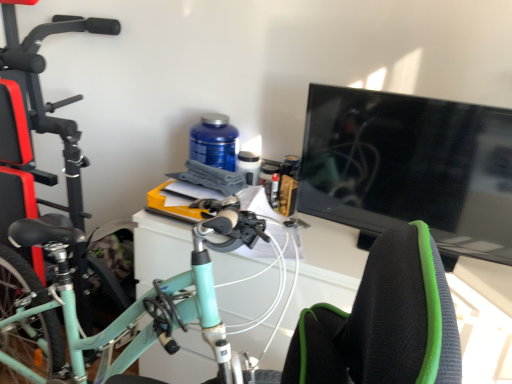
Image resolution: width=512 pixels, height=384 pixels. Describe the element at coordinates (214, 142) in the screenshot. I see `blue plastic bottle at center` at that location.

Where is `mint green matte bicycle at left`? mint green matte bicycle at left is located at coordinates pyautogui.click(x=31, y=143).

Where is `black glossy tv at right`? black glossy tv at right is located at coordinates (410, 167).

The width and height of the screenshot is (512, 384). In order to click on blue plastic bottle at center in this screenshot , I will do `click(214, 142)`.

Does point (326, 168) lie behind point (175, 230)?

No, (326, 168) is in front of (175, 230).

Is black glossy tv at right oriented towards white glossy computer desk at center?

Yes, black glossy tv at right faces towards white glossy computer desk at center.

From the image's perspective, which is above, black glossy tv at right or white glossy computer desk at center?

black glossy tv at right.

Are black glossy tv at right and white glossy computer desk at center far apart?

That's not correct — black glossy tv at right is a little close to white glossy computer desk at center.

Is point (226, 139) more distant than point (349, 275)?

Yes, it is.

Does blue plastic bottle at center turn towards white glossy computer desk at center?

No.

Can you confirm if blue plastic bottle at center is bigger than white glossy computer desk at center?

Incorrect, blue plastic bottle at center is not larger than white glossy computer desk at center.

In the image, is blue plastic bottle at center positioned in front of or behind white glossy computer desk at center?

Visually, blue plastic bottle at center is located behind white glossy computer desk at center.

Is mint green matte bicycle at left at the back of white glossy computer desk at center?

That's not correct — white glossy computer desk at center is not looking away from mint green matte bicycle at left.

Is white glossy computer desk at center directly adjacent to mint green matte bicycle at left?

No, white glossy computer desk at center is not in contact with mint green matte bicycle at left.

Considering the positions of points (317, 231) and (77, 137), is point (317, 231) closer to camera compared to point (77, 137)?

That is True.

Locate an element on the screen. This screenshot has height=384, width=512. bicycle below the white glossy computer desk at center (from a real-world perspective) is located at coordinates (31, 143).

Between white glossy computer desk at center and black glossy tv at right, which one appears on the left side from the viewer's perspective?

white glossy computer desk at center is more to the left.

From the image's perspective, is white glossy computer desk at center below black glossy tv at right?

Yes.

Would you say white glossy computer desk at center is a long distance from black glossy tv at right?

That's not correct — white glossy computer desk at center is a little close to black glossy tv at right.

How many degrees apart are the facing directions of blue plastic bottle at center and mint green matte bicycle at left?

The angle between the facing direction of blue plastic bottle at center and the facing direction of mint green matte bicycle at left is 3.21 degrees.

Between blue plastic bottle at center and mint green matte bicycle at left, which one has less height?

With less height is blue plastic bottle at center.

From a real-world perspective, is blue plastic bottle at center above or below mint green matte bicycle at left?

From a real-world perspective, blue plastic bottle at center is physically above mint green matte bicycle at left.

From the image's perspective, which object appears higher, blue plastic bottle at center or mint green matte bicycle at left?

blue plastic bottle at center.

Considering the sizes of mint green matte bicycle at left and white glossy computer desk at center in the image, is mint green matte bicycle at left taller or shorter than white glossy computer desk at center?

Considering their sizes, mint green matte bicycle at left has more height than white glossy computer desk at center.

How many degrees apart are the facing directions of mint green matte bicycle at left and white glossy computer desk at center?

104 degrees separate the facing orientations of mint green matte bicycle at left and white glossy computer desk at center.

Is mint green matte bicycle at left not near white glossy computer desk at center?

No, mint green matte bicycle at left is not far from white glossy computer desk at center.

Considering the sizes of objects mint green matte bicycle at left and black glossy tv at right in the image provided, who is thinner, mint green matte bicycle at left or black glossy tv at right?

With smaller width is black glossy tv at right.

Which point is more distant from viewer, (27, 161) or (406, 141)?

The point (27, 161) is farther from the camera.

From the image's perspective, which is below, mint green matte bicycle at left or black glossy tv at right?

mint green matte bicycle at left.

I want to click on television on the right of white glossy computer desk at center, so click(410, 167).

Locate an element on the screen. computer desk below the blue plastic bottle at center (from the image's perspective) is located at coordinates (320, 278).

Looking at this image, when comparing their distances from blue plastic bottle at center, does mint green matte bicycle at left or white glossy computer desk at center seem further?

mint green matte bicycle at left is positioned further to the anchor blue plastic bottle at center.

Which object lies nearer to the anchor point mint green matte bicycle at left, white glossy computer desk at center or blue plastic bottle at center?

Among the two, white glossy computer desk at center is located nearer to mint green matte bicycle at left.

Considering their positions, is black glossy tv at right positioned closer to blue plastic bottle at center than white glossy computer desk at center?

Based on the image, white glossy computer desk at center appears to be nearer to blue plastic bottle at center.

From the image, which object appears to be nearer to mint green matte bicycle at left, white glossy computer desk at center or black glossy tv at right?

white glossy computer desk at center is closer to mint green matte bicycle at left.

From the image, which object appears to be farther from black glossy tv at right, blue plastic bottle at center or white glossy computer desk at center?

blue plastic bottle at center.

Based on their spatial positions, is mint green matte bicycle at left or blue plastic bottle at center further from white glossy computer desk at center?

mint green matte bicycle at left lies further to white glossy computer desk at center than the other object.

Considering their positions, is mint green matte bicycle at left positioned further to blue plastic bottle at center than black glossy tv at right?

The object further to blue plastic bottle at center is mint green matte bicycle at left.

Which object lies further to the anchor point mint green matte bicycle at left, black glossy tv at right or white glossy computer desk at center?

Among the two, black glossy tv at right is located further to mint green matte bicycle at left.

You are a GUI agent. You are given a task and a screenshot of the screen. Output one action in this format:
    pyautogui.click(x=<x>, y=<y>)
    Task: Click on the television between white glossy computer desk at center and blue plastic bottle at center from front to back
    
    Given the screenshot: What is the action you would take?
    pyautogui.click(x=410, y=167)

The image size is (512, 384). I want to click on computer desk between mint green matte bicycle at left and black glossy tv at right from left to right, so click(x=320, y=278).

The width and height of the screenshot is (512, 384). Identify the location of bicycle between white glossy computer desk at center and blue plastic bottle at center along the z-axis. (31, 143).

You are a GUI agent. You are given a task and a screenshot of the screen. Output one action in this format:
    pyautogui.click(x=<x>, y=<y>)
    Task: Click on the bottle between mint green matte bicycle at left and black glossy tv at right
    
    Given the screenshot: What is the action you would take?
    pyautogui.click(x=214, y=142)